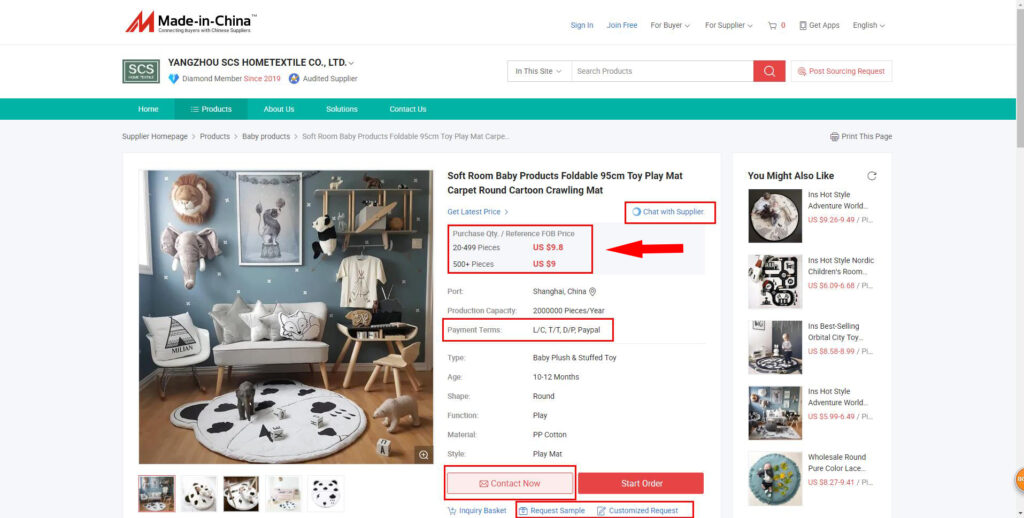
Find the location of a particular element. white and black rug is located at coordinates (302, 441).